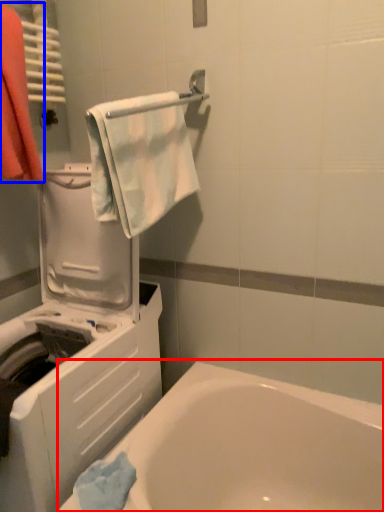
Question: Which point is further to the camera, bathtub (highlighted by a red box) or laundry (highlighted by a blue box)?

Choices:
 (A) bathtub
 (B) laundry

Answer: (B)